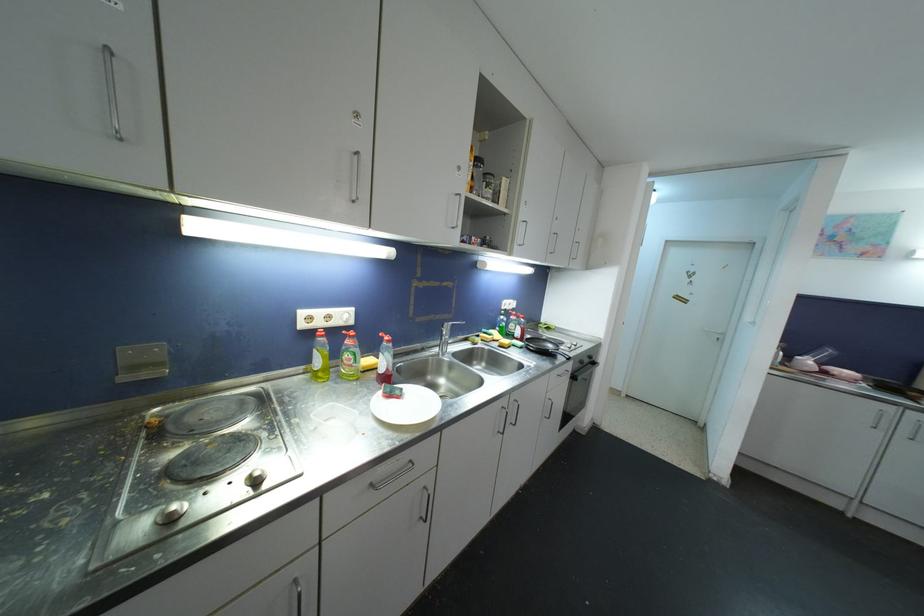
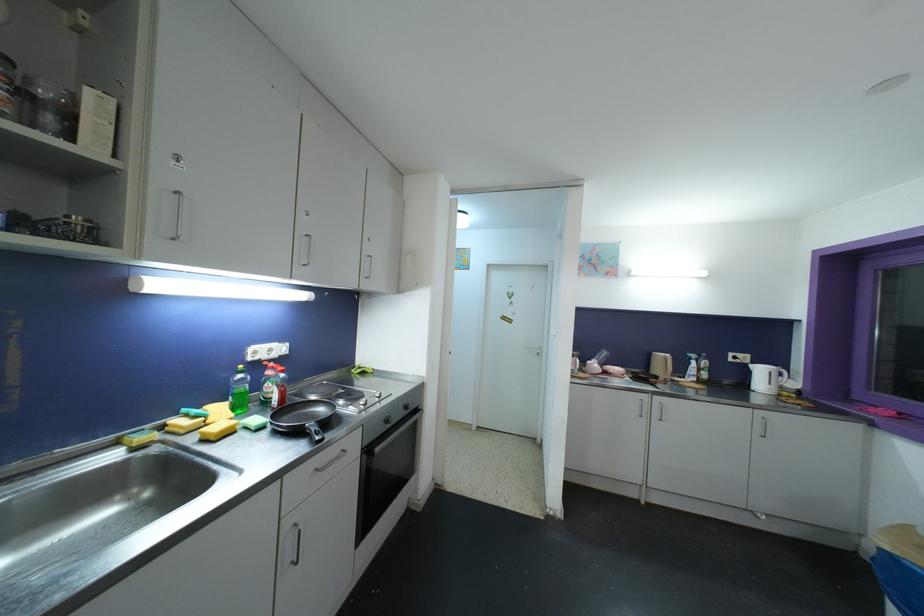
Locate, in the second image, the point that corresponds to pixel 585 365 in the first image.

(390, 424)